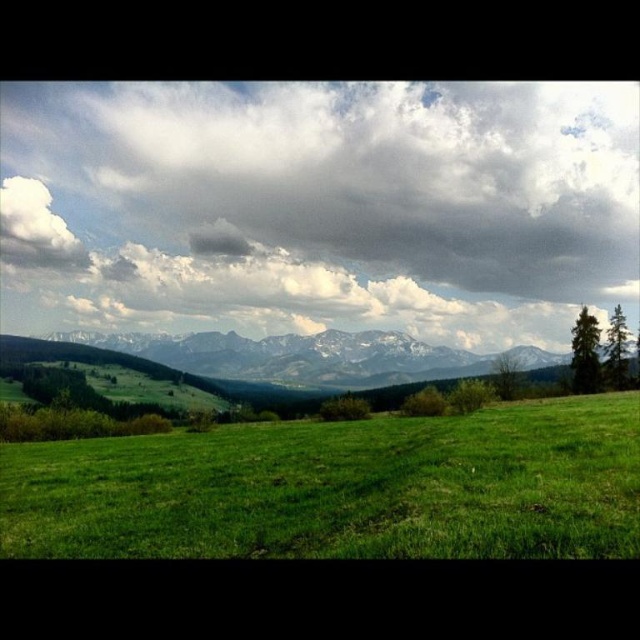
You are an airplane pilot flying over the landscape and need to identify the highest point between the cloudy sky at upper center and the white fluffy cloud at upper left. Which one is higher?

The cloudy sky at upper center has a greater height compared to the white fluffy cloud at upper left, so the cloudy sky at upper center is higher.

You are standing at the origin point in the image. Which direction should you move to reach the green grassy field at lower center?

The green grassy field at lower center is located at coordinates point (340, 486), so you should move towards the lower center direction to reach it.